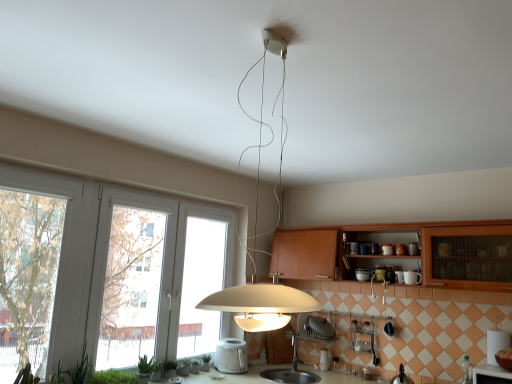
Question: Looking at their shapes, would you say white glossy toaster at center, which appears as the 1th appliance when viewed from the right, is wider or thinner than matte white pendant light at center?

Choices:
 (A) thin
 (B) wide

Answer: (A)

Question: From a real-world perspective, is white glossy toaster at center, which appears as the 1th appliance when viewed from the right, above or below matte white pendant light at center?

Choices:
 (A) above
 (B) below

Answer: (B)

Question: Which is farther from the metallic silver faucet at lower center?

Choices:
 (A) green leafy plant at lower left, which appears as the fourth plant when viewed from the front
 (B) green matte plant at lower left, which ranks as the fourth plant in right-to-left order
 (C) green matte plant at lower center, which is the 6th plant in front-to-back order
 (D) white plastic toaster at center, the first appliance viewed from the left
 (E) matte white pendant light at center

Answer: (B)

Question: Which object is the closest to the green leafy plant at lower left, arranged as the 5th plant when viewed from the back?

Choices:
 (A) green leafy plant at lower left, which ranks as the 3th plant in back-to-front order
 (B) matte white pendant light at center
 (C) white glossy toaster at center, the second appliance when ordered from left to right
 (D) green matte plant at lower center, arranged as the fifth plant when viewed from the left
 (E) white plastic window at left

Answer: (A)